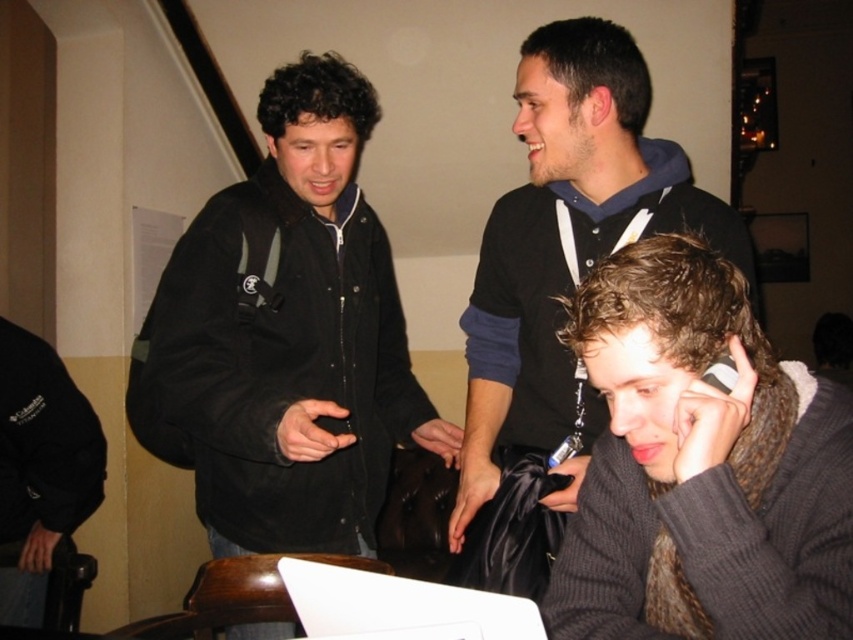
Question: Is dark gray knitted sweater at lower right bigger than white matte laptop at center?

Choices:
 (A) no
 (B) yes

Answer: (B)

Question: From the image, what is the correct spatial relationship of black fabric jacket at left in relation to white matte laptop at center?

Choices:
 (A) right
 (B) left

Answer: (B)

Question: Among these points, which one is nearest to the camera?

Choices:
 (A) (521, 140)
 (B) (807, 540)
 (C) (350, 616)

Answer: (B)

Question: Which of the following is the farthest from the observer?

Choices:
 (A) (322, 605)
 (B) (732, 282)
 (C) (532, 132)
 (D) (167, 387)

Answer: (C)

Question: Can you confirm if black hoodie at upper center is smaller than white matte laptop at center?

Choices:
 (A) yes
 (B) no

Answer: (B)

Question: Which object appears farthest from the camera in this image?

Choices:
 (A) black hoodie at upper center
 (B) black fabric jacket at left

Answer: (B)